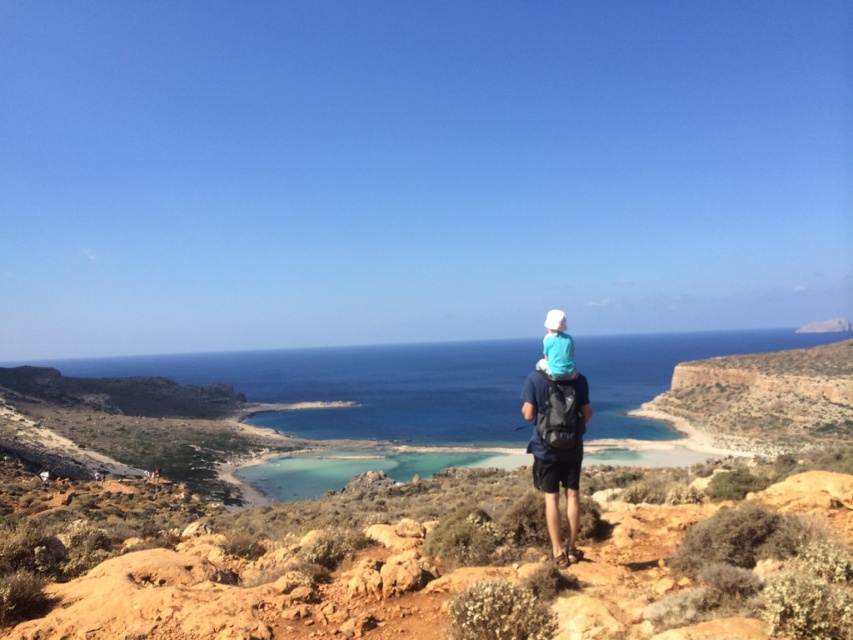
Question: Is clear blue water at center positioned behind white matte hat at center?

Choices:
 (A) no
 (B) yes

Answer: (B)

Question: Is clear blue water at center below blue fabric backpack at center?

Choices:
 (A) no
 (B) yes

Answer: (B)

Question: Which object appears closest to the camera in this image?

Choices:
 (A) clear blue water at center
 (B) blue fabric backpack at center

Answer: (B)

Question: Which of these objects is positioned closest to the blue fabric backpack at center?

Choices:
 (A) clear blue water at center
 (B) white matte hat at center

Answer: (B)

Question: Considering the relative positions of clear blue water at center and white matte hat at center in the image provided, where is clear blue water at center located with respect to white matte hat at center?

Choices:
 (A) above
 (B) below

Answer: (B)

Question: Which of the following is the closest to the observer?

Choices:
 (A) (582, 390)
 (B) (335, 348)
 (C) (560, 378)

Answer: (C)